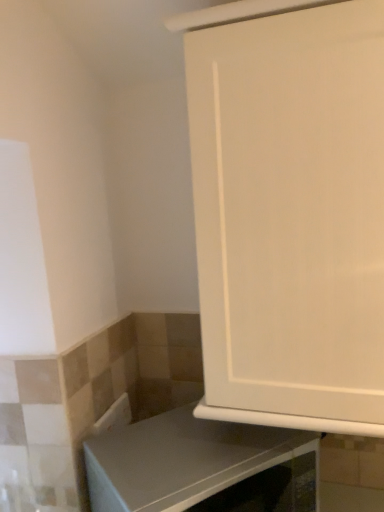
Question: From the image's perspective, is gray matte countertop at lower center located beneath white matte cabinet at center?

Choices:
 (A) no
 (B) yes

Answer: (B)

Question: From a real-world perspective, is gray matte countertop at lower center under white matte cabinet at center?

Choices:
 (A) no
 (B) yes

Answer: (B)

Question: Could you tell me if gray matte countertop at lower center is turned towards white matte cabinet at center?

Choices:
 (A) yes
 (B) no

Answer: (B)

Question: Is gray matte countertop at lower center positioned far away from white matte cabinet at center?

Choices:
 (A) no
 (B) yes

Answer: (A)

Question: Is gray matte countertop at lower center bigger than white matte cabinet at center?

Choices:
 (A) yes
 (B) no

Answer: (B)

Question: Does gray matte countertop at lower center appear on the right side of white matte cabinet at center?

Choices:
 (A) no
 (B) yes

Answer: (A)

Question: From a real-world perspective, is white matte cabinet at center under gray matte countertop at lower center?

Choices:
 (A) no
 (B) yes

Answer: (A)

Question: From the image's perspective, is white matte cabinet at center over gray matte countertop at lower center?

Choices:
 (A) no
 (B) yes

Answer: (B)

Question: Does white matte cabinet at center appear on the right side of gray matte countertop at lower center?

Choices:
 (A) no
 (B) yes

Answer: (B)

Question: Is white matte cabinet at center closer to camera compared to gray matte countertop at lower center?

Choices:
 (A) yes
 (B) no

Answer: (A)

Question: Is white matte cabinet at center behind gray matte countertop at lower center?

Choices:
 (A) no
 (B) yes

Answer: (A)

Question: Does white matte cabinet at center have a lesser width compared to gray matte countertop at lower center?

Choices:
 (A) no
 (B) yes

Answer: (A)

Question: Considering their positions, is gray matte countertop at lower center located in front of or behind white matte cabinet at center?

Choices:
 (A) behind
 (B) front

Answer: (A)